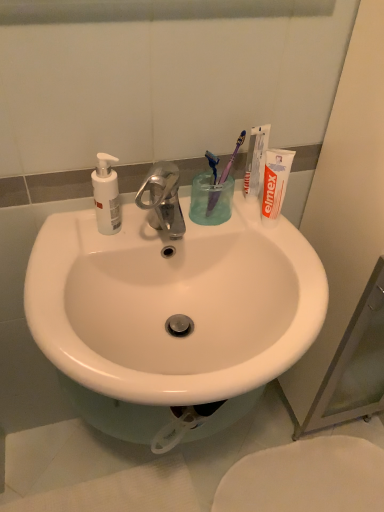
What do you see at coordinates (275, 183) in the screenshot?
I see `white matte toothpaste tube at upper right` at bounding box center [275, 183].

I want to click on purple plastic toothbrush at upper center, which appears as the first toothbrush when viewed from the left, so click(x=212, y=163).

Consider the image. What is the approximate height of white glossy toilet at lower right?

It is 1.13 inches.

Find the location of a particular element. transparent plastic cup at center is located at coordinates (211, 200).

The width and height of the screenshot is (384, 512). What do you see at coordinates (174, 304) in the screenshot?
I see `white glossy sink at center` at bounding box center [174, 304].

The width and height of the screenshot is (384, 512). Describe the element at coordinates (106, 195) in the screenshot. I see `white matte soap dispenser at left` at that location.

What do you see at coordinates (256, 160) in the screenshot? The height and width of the screenshot is (512, 384). I see `white matte toothpaste at upper right` at bounding box center [256, 160].

This screenshot has height=512, width=384. What do you see at coordinates (232, 158) in the screenshot? I see `purple plastic toothbrush at upper right, arranged as the second toothbrush when viewed from the left` at bounding box center [232, 158].

You are a GUI agent. You are given a task and a screenshot of the screen. Output one action in this format:
    pyautogui.click(x=<x>, y=<y>)
    Task: Click on the white matte toothpaste tube at upper right
    
    Given the screenshot: What is the action you would take?
    pyautogui.click(x=275, y=183)

Is transparent plastic cup at center taller or shorter than white matte toothpaste at upper right?

Clearly, transparent plastic cup at center is shorter compared to white matte toothpaste at upper right.

Is transparent plastic cup at center to the right of white matte toothpaste at upper right from the viewer's perspective?

No, transparent plastic cup at center is not to the right of white matte toothpaste at upper right.

This screenshot has height=512, width=384. In the image, there is a white matte toothpaste at upper right. Identify the location of liquid below it (from the image's perspective). (211, 200).

In the scene shown: Is transparent plastic cup at center completely or partially outside of white matte toothpaste at upper right?

transparent plastic cup at center is positioned outside white matte toothpaste at upper right.

Looking at this image, does white glossy sink at center have a smaller size compared to white matte soap dispenser at left?

Incorrect, white glossy sink at center is not smaller in size than white matte soap dispenser at left.

Which object is more forward, white glossy sink at center or white matte soap dispenser at left?

Positioned in front is white glossy sink at center.

From a real-world perspective, is white glossy sink at center physically above white matte soap dispenser at left?

No.

Which point is more distant from viewer, (243, 369) or (102, 163)?

Positioned behind is point (102, 163).

Looking at this image, between white matte soap dispenser at left and purple plastic toothbrush at upper center, which appears as the 2th toothbrush when viewed from the right, which one has smaller width?

With smaller width is purple plastic toothbrush at upper center, which appears as the 2th toothbrush when viewed from the right.

Can we say white matte soap dispenser at left lies outside purple plastic toothbrush at upper center, which appears as the first toothbrush when viewed from the left?

Indeed, white matte soap dispenser at left is completely outside purple plastic toothbrush at upper center, which appears as the first toothbrush when viewed from the left.

Who is bigger, white matte soap dispenser at left or purple plastic toothbrush at upper center, which appears as the 2th toothbrush when viewed from the right?

Bigger between the two is white matte soap dispenser at left.

You are a GUI agent. You are given a task and a screenshot of the screen. Output one action in this format:
    pyautogui.click(x=<x>, y=<y>)
    Task: Click on the liquid above the white glossy toilet at lower right (from the image's perspective)
    Image resolution: width=384 pixels, height=512 pixels.
    Given the screenshot: What is the action you would take?
    pyautogui.click(x=211, y=200)

How different are the orientations of transparent plastic cup at center and white glossy toilet at lower right in degrees?

They differ by 1.52 degrees in their facing directions.

Is transparent plastic cup at center positioned with its back to white glossy toilet at lower right?

No.

Which is more to the left, transparent plastic cup at center or white glossy toilet at lower right?

Positioned to the left is transparent plastic cup at center.

Considering the sizes of white glossy sink at center and purple plastic toothbrush at upper right, the 1th toothbrush in the right-to-left sequence, in the image, is white glossy sink at center taller or shorter than purple plastic toothbrush at upper right, the 1th toothbrush in the right-to-left sequence,?

In the image, white glossy sink at center appears to be taller than purple plastic toothbrush at upper right, the 1th toothbrush in the right-to-left sequence.

Would you say white glossy sink at center is to the left or to the right of purple plastic toothbrush at upper right, the 1th toothbrush in the right-to-left sequence, in the picture?

white glossy sink at center is positioned on purple plastic toothbrush at upper right, the 1th toothbrush in the right-to-left sequence,'s left side.

From a real-world perspective, who is located lower, white glossy sink at center or purple plastic toothbrush at upper right, the 1th toothbrush in the right-to-left sequence?

white glossy sink at center, from a real-world perspective.

Does white glossy sink at center lie in front of purple plastic toothbrush at upper right, the 1th toothbrush in the right-to-left sequence?

Yes, white glossy sink at center is closer to the camera.

Would you say white glossy toilet at lower right is to the left or to the right of white matte toothpaste tube at upper right in the picture?

white glossy toilet at lower right is positioned on white matte toothpaste tube at upper right's right side.

From a real-world perspective, is white glossy toilet at lower right below white matte toothpaste tube at upper right?

Indeed, from a real-world perspective, white glossy toilet at lower right is positioned beneath white matte toothpaste tube at upper right.

Is white glossy toilet at lower right oriented away from white matte toothpaste tube at upper right?

No, white matte toothpaste tube at upper right is not at the back of white glossy toilet at lower right.

Can we say white matte soap dispenser at left lies outside white glossy sink at center?

Absolutely, white matte soap dispenser at left is external to white glossy sink at center.

Is point (109, 170) closer to viewer compared to point (102, 256)?

Yes.

Identify the location of soap dispenser that appears above the white glossy sink at center (from a real-world perspective). (106, 195).

Considering the relative sizes of white matte soap dispenser at left and white glossy sink at center in the image provided, is white matte soap dispenser at left smaller than white glossy sink at center?

Yes, white matte soap dispenser at left is smaller than white glossy sink at center.

Locate an element on the screen. toothpaste that appears above the transparent plastic cup at center (from a real-world perspective) is located at coordinates (256, 160).

Locate an element on the screen. The width and height of the screenshot is (384, 512). sink on the right side of white matte soap dispenser at left is located at coordinates (174, 304).

Estimate the real-world distances between objects in this image. Which object is further from purple plastic toothbrush at upper right, arranged as the second toothbrush when viewed from the left, white matte toothpaste tube at upper right or white glossy toilet at lower right?

white glossy toilet at lower right is positioned further to the anchor purple plastic toothbrush at upper right, arranged as the second toothbrush when viewed from the left.

Which object lies further to the anchor point white matte soap dispenser at left, purple plastic toothbrush at upper center, which appears as the 2th toothbrush when viewed from the right, or white glossy sink at center?

white glossy sink at center lies further to white matte soap dispenser at left than the other object.

Estimate the real-world distances between objects in this image. Which object is closer to purple plastic toothbrush at upper center, which appears as the 2th toothbrush when viewed from the right, transparent plastic cup at center or white matte toothpaste tube at upper right?

The object closer to purple plastic toothbrush at upper center, which appears as the 2th toothbrush when viewed from the right, is transparent plastic cup at center.

Which object lies nearer to the anchor point white glossy sink at center, purple plastic toothbrush at upper right, the 1th toothbrush in the right-to-left sequence, or purple plastic toothbrush at upper center, which appears as the first toothbrush when viewed from the left?

purple plastic toothbrush at upper right, the 1th toothbrush in the right-to-left sequence, lies closer to white glossy sink at center than the other object.

Considering their positions, is white matte soap dispenser at left positioned further to purple plastic toothbrush at upper center, which appears as the first toothbrush when viewed from the left, than white glossy sink at center?

white glossy sink at center.

Which object lies further to the anchor point white matte toothpaste tube at upper right, white matte toothpaste at upper right or transparent plastic cup at center?

transparent plastic cup at center is positioned further to the anchor white matte toothpaste tube at upper right.

Consider the image. Estimate the real-world distances between objects in this image. Which object is closer to purple plastic toothbrush at upper center, which appears as the 2th toothbrush when viewed from the right, transparent plastic cup at center or white glossy toilet at lower right?

Among the two, transparent plastic cup at center is located nearer to purple plastic toothbrush at upper center, which appears as the 2th toothbrush when viewed from the right.

Looking at the image, which one is located closer to white matte soap dispenser at left, white matte toothpaste tube at upper right or white glossy sink at center?

white glossy sink at center is closer to white matte soap dispenser at left.

The image size is (384, 512). What are the coordinates of `soap dispenser that lies between white matte toothpaste at upper right and white glossy toilet at lower right from top to bottom` in the screenshot? It's located at (106, 195).

Find the location of a particular element. liquid located between white matte soap dispenser at left and white matte toothpaste at upper right in the left-right direction is located at coordinates (211, 200).

Image resolution: width=384 pixels, height=512 pixels. Identify the location of sink between white matte soap dispenser at left and white glossy toilet at lower right in the vertical direction. (174, 304).

The width and height of the screenshot is (384, 512). In order to click on toothbrush between transparent plastic cup at center and white matte toothpaste tube at upper right from left to right in this screenshot , I will do `click(232, 158)`.